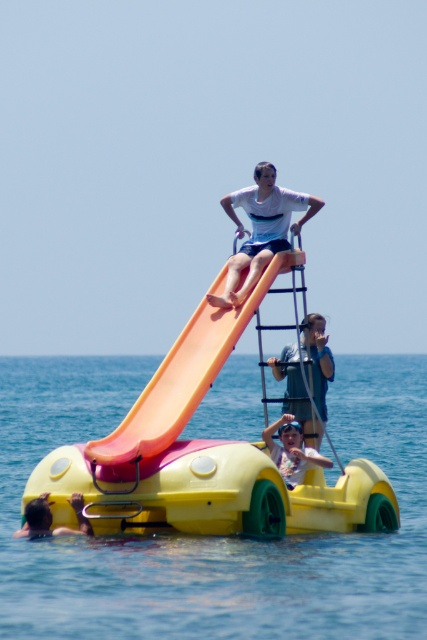
Who is shorter, yellow matte pedal boat at upper center or blue denim shorts at center?

blue denim shorts at center

Who is lower down, yellow matte pedal boat at upper center or blue denim shorts at center?

Positioned lower is blue denim shorts at center.

The image size is (427, 640). Find the location of `yellow matte pedal boat at upper center`. yellow matte pedal boat at upper center is located at coordinates (202, 456).

Can you confirm if yellow matte pedal boat at upper center is positioned below dark brown hair at lower left?

No.

Who is more distant from viewer, (x=167, y=358) or (x=43, y=493)?

Positioned behind is point (x=167, y=358).

Identify the location of yellow matte pedal boat at upper center. Image resolution: width=427 pixels, height=640 pixels. (202, 456).

Locate an element on the screen. yellow matte pedal boat at upper center is located at coordinates (202, 456).

Does transparent plastic water at center appear on the right side of blue denim shorts at center?

In fact, transparent plastic water at center is to the left of blue denim shorts at center.

Identify the location of transparent plastic water at center. Image resolution: width=427 pixels, height=640 pixels. (213, 536).

Is point (2, 380) in front of point (280, 371)?

No, (2, 380) is further to viewer.

The image size is (427, 640). What are the coordinates of `transparent plastic water at center` in the screenshot? It's located at (213, 536).